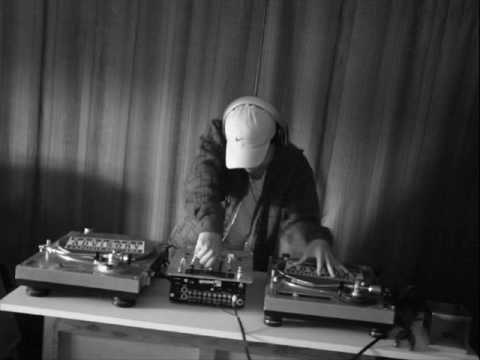
The image size is (480, 360). In order to click on tabletop in this screenshot , I will do `click(172, 315)`.